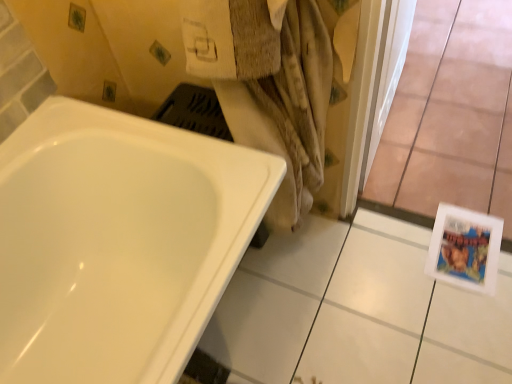
Question: Considering the relative positions of white glossy bathtub at lower left and beige textured towel at center in the image provided, is white glossy bathtub at lower left to the right of beige textured towel at center from the viewer's perspective?

Choices:
 (A) yes
 (B) no

Answer: (B)

Question: From the image's perspective, does white glossy bathtub at lower left appear higher than beige textured towel at center?

Choices:
 (A) no
 (B) yes

Answer: (A)

Question: Is white glossy bathtub at lower left outside of beige textured towel at center?

Choices:
 (A) yes
 (B) no

Answer: (A)

Question: Does white glossy bathtub at lower left have a greater width compared to beige textured towel at center?

Choices:
 (A) no
 (B) yes

Answer: (B)

Question: Is white glossy bathtub at lower left closer to camera compared to beige textured towel at center?

Choices:
 (A) no
 (B) yes

Answer: (B)

Question: Is white glossy bathtub at lower left looking in the opposite direction of beige textured towel at center?

Choices:
 (A) no
 (B) yes

Answer: (A)

Question: Can you confirm if white glossy bathtub at lower left is wider than transparent glass door at lower right?

Choices:
 (A) no
 (B) yes

Answer: (A)

Question: Is white glossy bathtub at lower left positioned before transparent glass door at lower right?

Choices:
 (A) yes
 (B) no

Answer: (A)

Question: Is white glossy bathtub at lower left behind transparent glass door at lower right?

Choices:
 (A) no
 (B) yes

Answer: (A)

Question: Is white glossy bathtub at lower left completely or partially outside of transparent glass door at lower right?

Choices:
 (A) yes
 (B) no

Answer: (A)

Question: Does white glossy bathtub at lower left appear on the left side of transparent glass door at lower right?

Choices:
 (A) no
 (B) yes

Answer: (B)

Question: Is white glossy bathtub at lower left taller than transparent glass door at lower right?

Choices:
 (A) yes
 (B) no

Answer: (A)

Question: From the image's perspective, would you say transparent glass door at lower right is shown under beige textured towel at center?

Choices:
 (A) no
 (B) yes

Answer: (A)